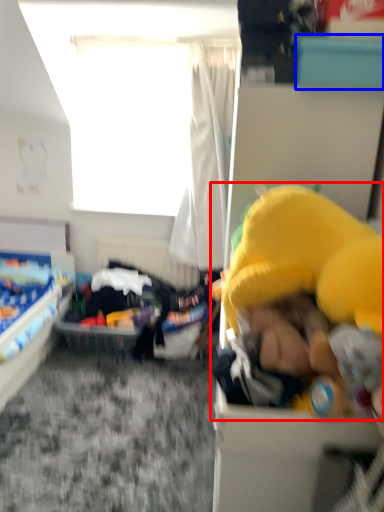
Question: Among these objects, which one is nearest to the camera, toy (highlighted by a red box) or box (highlighted by a blue box)?

Choices:
 (A) toy
 (B) box

Answer: (A)